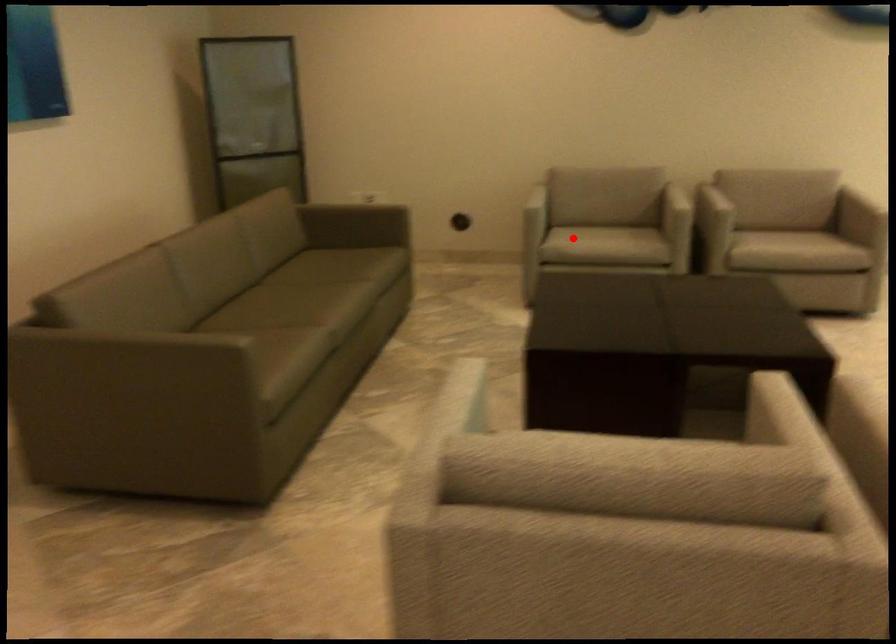
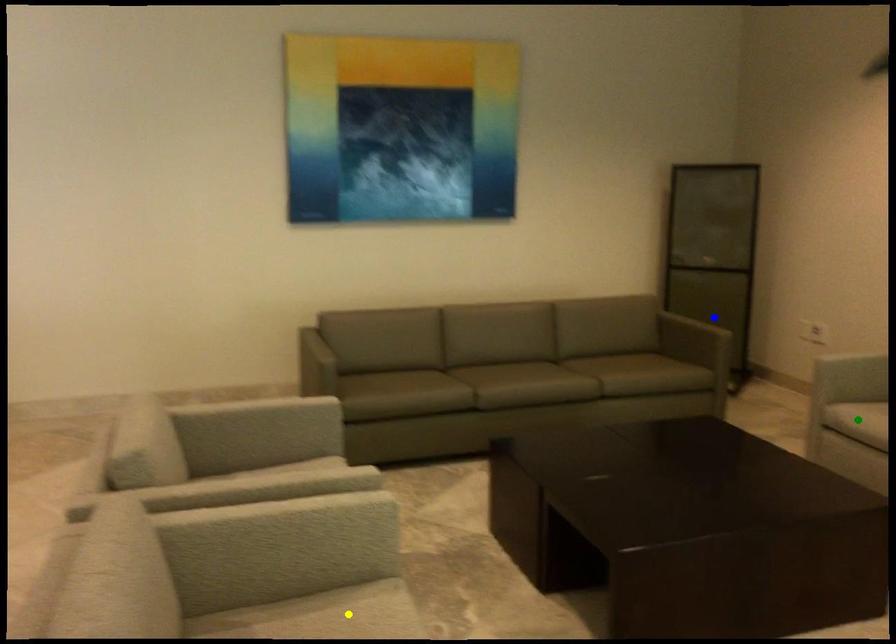
Question: I am providing you with two images of the same scene from different viewpoints. A red point is marked on the first image. You are given multiple points on the second image. Which spot in image 2 lines up with the point in image 1?

Choices:
 (A) blue point
 (B) green point
 (C) yellow point

Answer: (B)